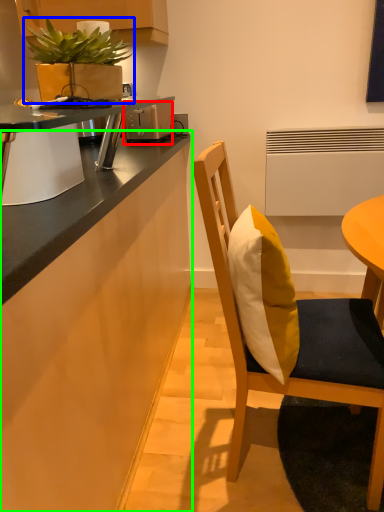
Question: Which object is the farthest from toaster (highlighted by a red box)? Choose among these: houseplant (highlighted by a blue box) or cabinetry (highlighted by a green box).

Choices:
 (A) houseplant
 (B) cabinetry

Answer: (B)